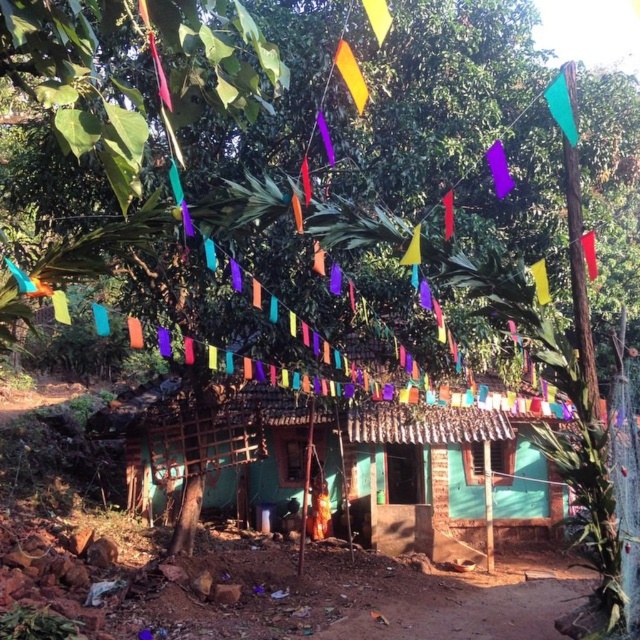
Question: Is yellow paper flag at center positioned behind red fabric flag at upper center?

Choices:
 (A) yes
 (B) no

Answer: (B)

Question: Is red fabric flag at upper center wider than orange fabric flag at center?

Choices:
 (A) yes
 (B) no

Answer: (A)

Question: Does red fabric flag at upper right appear under orange fabric flag at center?

Choices:
 (A) no
 (B) yes

Answer: (A)

Question: Among these objects, which one is nearest to the camera?

Choices:
 (A) yellow fabric flag at upper right
 (B) red fabric flag at upper center

Answer: (A)

Question: Which point appears farthest from the camera in this image?

Choices:
 (A) (566, 124)
 (B) (307, 168)
 (C) (358, 83)
 (D) (96, 304)

Answer: (D)

Question: Which object is farther from the camera taking this photo?

Choices:
 (A) red fabric flag at upper center
 (B) purple fabric flag at center

Answer: (B)